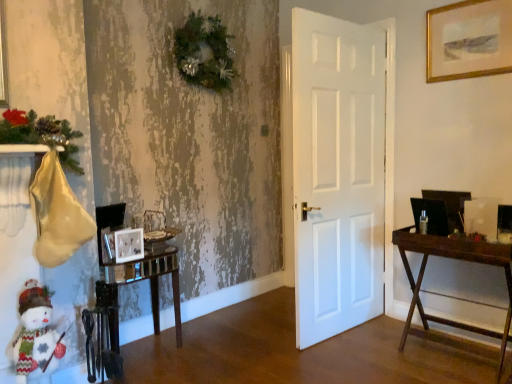
Where is `free space that is to the left of wooden desk at right`? The image size is (512, 384). free space that is to the left of wooden desk at right is located at coordinates (369, 354).